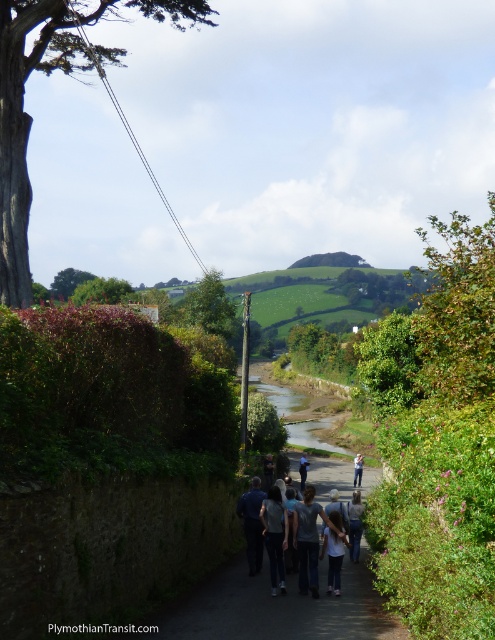
Question: Based on their relative distances, which object is nearer to the green grassy hill at center?

Choices:
 (A) light blue denim jeans at center
 (B) light gray cotton shirt at center
 (C) dark gray sweater at center

Answer: (B)

Question: Is dark gray shirt at center in front of light gray cotton shirt at center?

Choices:
 (A) yes
 (B) no

Answer: (A)

Question: Estimate the real-world distances between objects in this image. Which object is farther from the dark gray shirt at center?

Choices:
 (A) denim jeans at center
 (B) light gray cotton shirt at center
 (C) light blue denim jeans at center

Answer: (B)

Question: Does dark gray shirt at center appear over light gray cotton shirt at center?

Choices:
 (A) no
 (B) yes

Answer: (B)

Question: Which point appears farthest from the camera in this image?

Choices:
 (A) [x=392, y=292]
 (B) [x=270, y=563]
 (C) [x=303, y=488]

Answer: (A)

Question: Can you confirm if green grassy hill at center is wider than dark gray sweater at center?

Choices:
 (A) yes
 (B) no

Answer: (A)